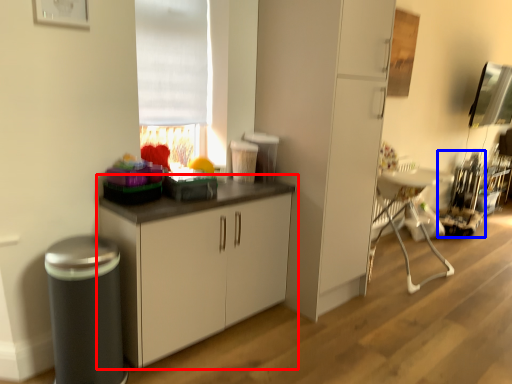
Question: Which object appears farthest to the camera in this image, cabinetry (highlighted by a red box) or appliance (highlighted by a blue box)?

Choices:
 (A) cabinetry
 (B) appliance

Answer: (B)